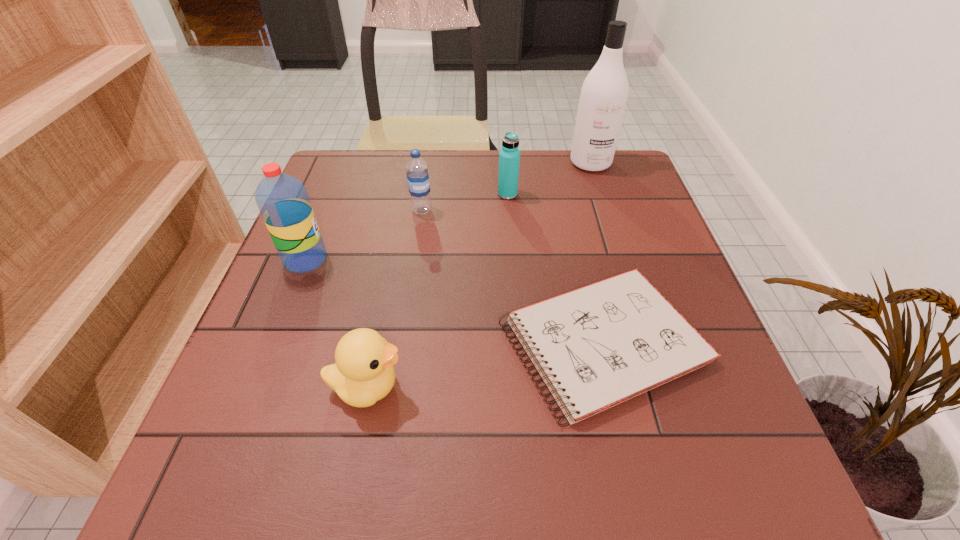
The height and width of the screenshot is (540, 960). I want to click on free space located 0.200m on the front-facing side of the shampoo, so click(610, 221).

Where is `vacant space situated on the front label of the tallest water bottle`? vacant space situated on the front label of the tallest water bottle is located at coordinates (386, 260).

You are a GUI agent. You are given a task and a screenshot of the screen. Output one action in this format:
    pyautogui.click(x=<x>, y=<y>)
    Task: Click on the blank space located on the left of the farthest water bottle
    
    Given the screenshot: What is the action you would take?
    pyautogui.click(x=436, y=194)

This screenshot has width=960, height=540. What are the coordinates of `free location located 0.320m on the label of the third farthest object` in the screenshot? It's located at (405, 320).

Identify the location of free space located on the face of the second shortest object. (624, 387).

Find the location of a particular element. The height and width of the screenshot is (540, 960). free region located 0.120m on the left of the shortest object is located at coordinates (434, 342).

The height and width of the screenshot is (540, 960). Identify the location of shampoo that is at the far edge. tap(603, 98).

At what (x,y) coordinates should I click in order to perform the action: click on water bottle at the far edge. Please return your answer as a coordinate pair (x, y). The width and height of the screenshot is (960, 540). Looking at the image, I should click on (509, 156).

Where is `object at the left edge`? This screenshot has width=960, height=540. object at the left edge is located at coordinates (283, 201).

Locate an element on the screen. The image size is (960, 540). shampoo that is at the right edge is located at coordinates (603, 98).